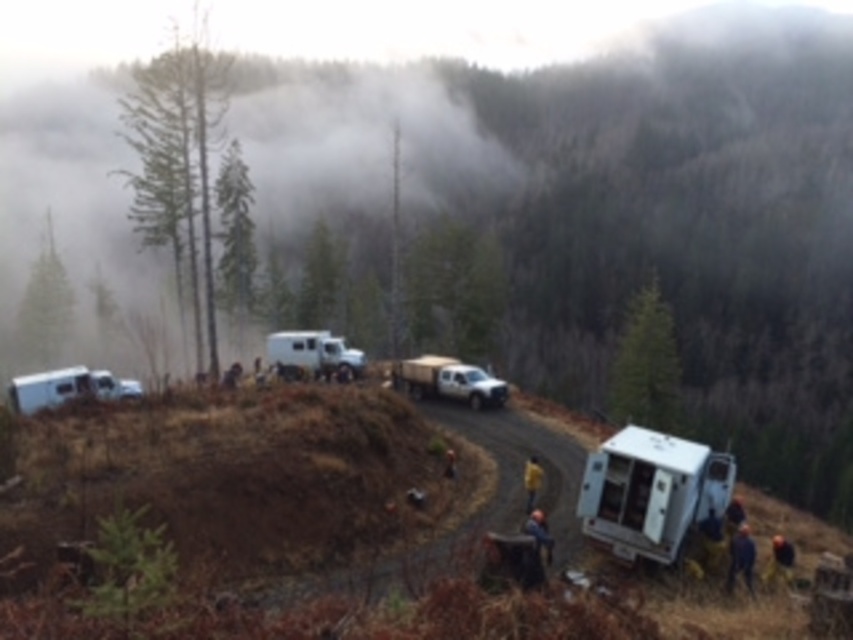
Is white matte recreational vehicle at lower left above yellow fabric person at lower right?

Indeed, white matte recreational vehicle at lower left is positioned over yellow fabric person at lower right.

Is white matte recreational vehicle at lower left positioned in front of yellow fabric person at lower right?

No, it is behind yellow fabric person at lower right.

Is point (44, 400) farther from camera compared to point (775, 544)?

Yes, point (44, 400) is behind point (775, 544).

Locate an element on the screen. The image size is (853, 640). white matte recreational vehicle at lower left is located at coordinates (67, 387).

Can you confirm if white matte recreational vehicle at center is positioned above yellow fabric at center?

Correct, white matte recreational vehicle at center is located above yellow fabric at center.

Where is `white matte recreational vehicle at center`? white matte recreational vehicle at center is located at coordinates (312, 353).

Is point (364, 360) positioned before point (525, 483)?

No, (364, 360) is behind (525, 483).

In order to click on white matte recreational vehicle at center in this screenshot , I will do `click(312, 353)`.

Is dark brown leather jacket at center behind yellow hard hat at center?

Yes, it is.

Is dark brown leather jacket at center below yellow hard hat at center?

Actually, dark brown leather jacket at center is above yellow hard hat at center.

Is point (236, 380) positioned before point (450, 461)?

No, it is not.

Locate an element on the screen. dark brown leather jacket at center is located at coordinates (231, 376).